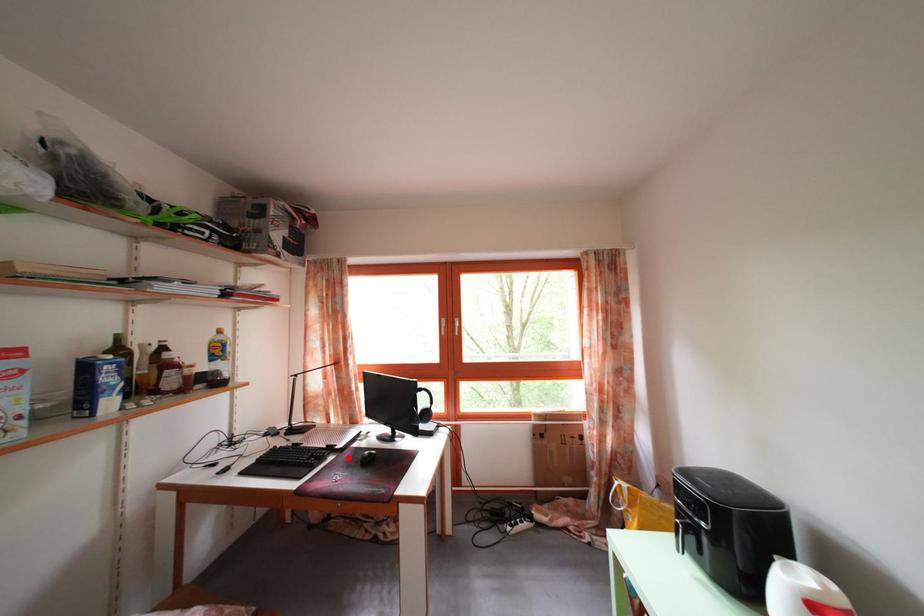
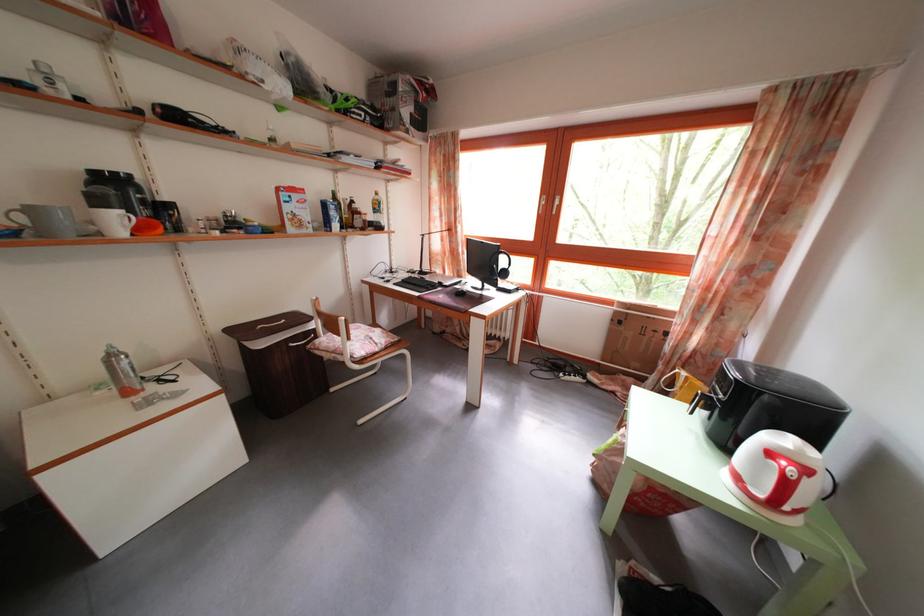
Where in the second image is the point corresponding to the highlighted location from the first image?

(454, 294)